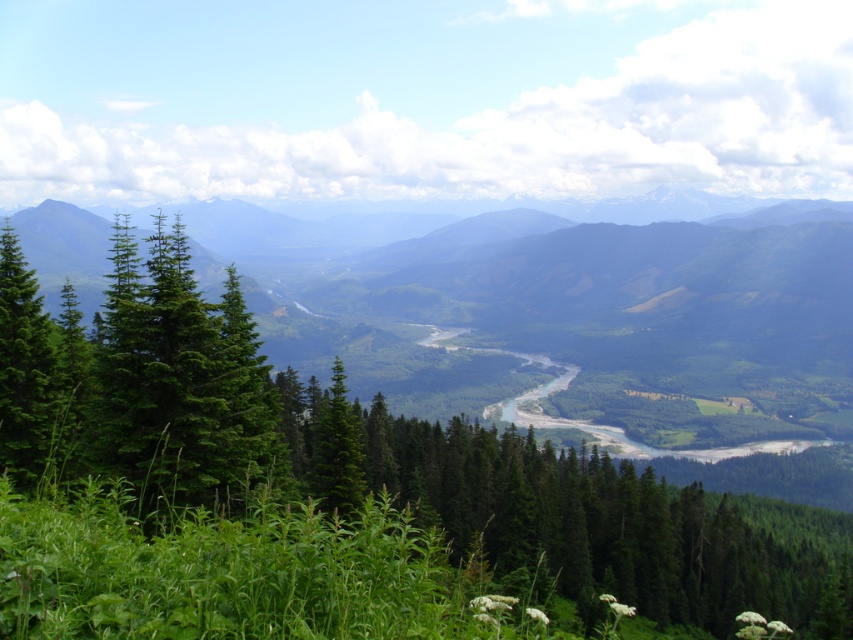
You are standing in the middle of the landscape and see the green evergreen tree at center and the green matte tree at left. Which tree is positioned to the right of the other?

The green evergreen tree at center is positioned to the right of the green matte tree at left.

You are standing at the point with coordinates point (3, 326) and want to walk towards the point (732, 509). Which direction should you move to get closer to your destination?

You should move forward because point (732, 509) is further to the viewer than point (3, 326), so moving forward will bring you closer to it.